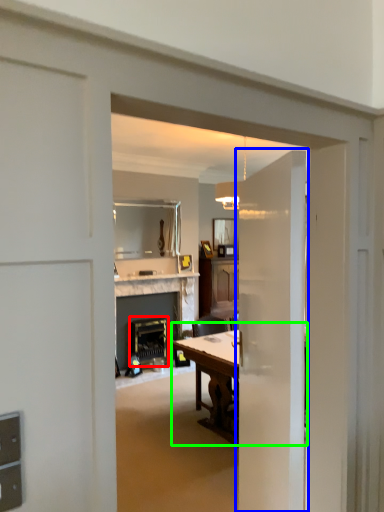
Question: Estimate the real-world distances between objects in this image. Which object is farther from appliance (highlighted by a red box), door (highlighted by a blue box) or table (highlighted by a green box)?

Choices:
 (A) door
 (B) table

Answer: (A)